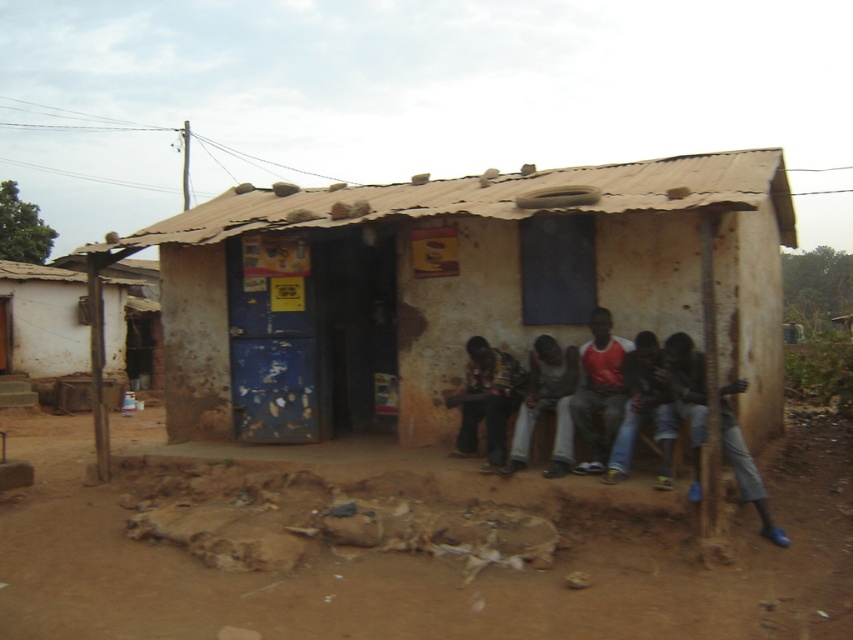
Looking at this image, you are a traveler passing by the white corrugated metal hut at left and the dark gray fabric pants at lower center. Which object is bigger in size?

The white corrugated metal hut at left is smaller than dark gray fabric pants at lower center according to the description, so the dark gray fabric pants at lower center is bigger in size.

You are standing at the entrance of the building and want to know where the dark gray fabric pants at lower center are located relative to you. Please describe their position using the coordinate system provided in the description.

The dark gray fabric pants at lower center are located at coordinate point 0.633 on the x axis and 0.783 on the y axis relative to your position at the entrance.

You are planning to set up a temporary tent for an event. The tent requires a space wider than the jeans at center. Based on the scene, can the brown dirt field at lower center accommodate the tent?

The brown dirt field at lower center is wider than the jeans at center, so the tent can be accommodated there.